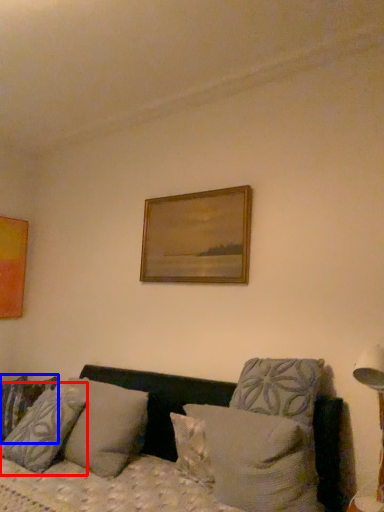
Question: Which object appears farthest to the camera in this image, pillow (highlighted by a red box) or pillow (highlighted by a blue box)?

Choices:
 (A) pillow
 (B) pillow

Answer: (B)